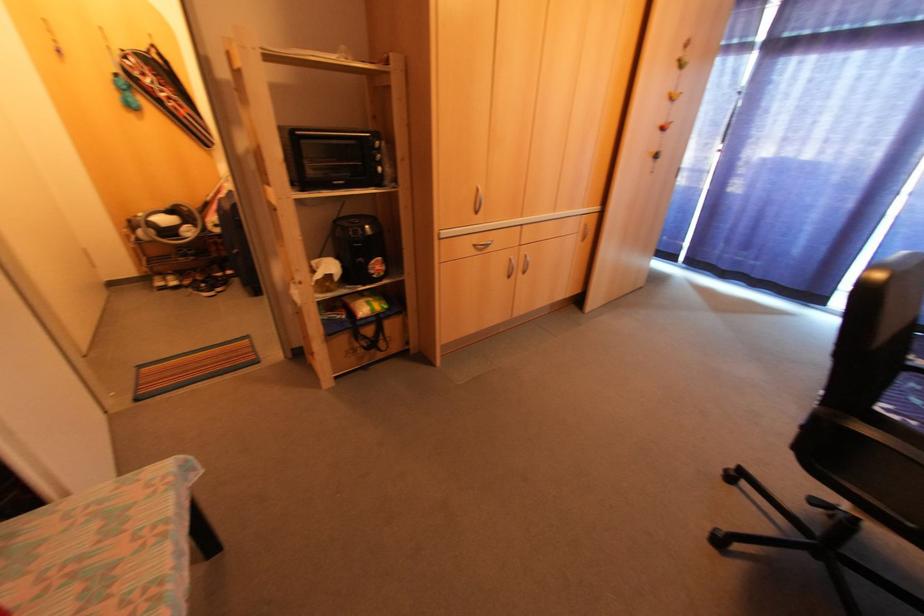
This screenshot has height=616, width=924. In order to click on black chair armrest in this screenshot , I will do `click(892, 423)`.